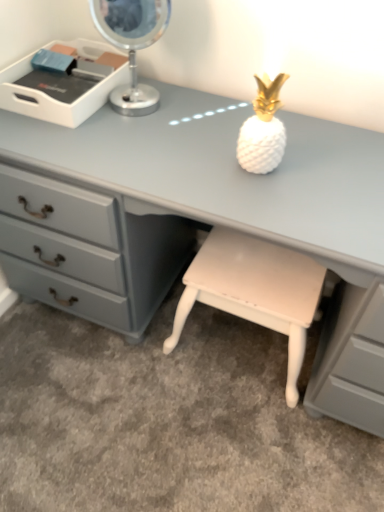
The image size is (384, 512). What are the coordinates of `vacant area that lies to the right of white plastic tray at upper left` in the screenshot? It's located at (172, 117).